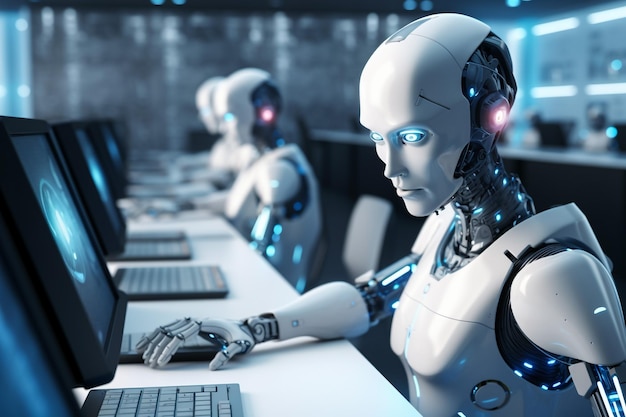
The image size is (626, 417). I want to click on monitors, so click(x=4, y=378), click(x=100, y=164), click(x=105, y=138), click(x=77, y=267).